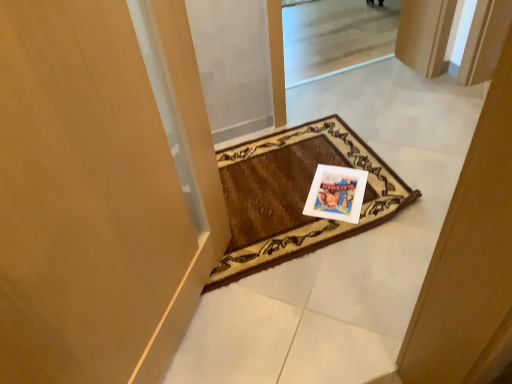
Question: Looking at their shapes, would you say white paper postcard at center is wider or thinner than brown woven mat at center?

Choices:
 (A) thin
 (B) wide

Answer: (A)

Question: Looking at the image, does white paper postcard at center seem bigger or smaller compared to brown woven mat at center?

Choices:
 (A) small
 (B) big

Answer: (A)

Question: Would you say white paper postcard at center is inside or outside brown woven mat at center?

Choices:
 (A) outside
 (B) inside

Answer: (B)

Question: Is brown woven mat at center wider or thinner than white paper postcard at center?

Choices:
 (A) wide
 (B) thin

Answer: (A)

Question: In terms of height, does brown woven mat at center look taller or shorter compared to white paper postcard at center?

Choices:
 (A) short
 (B) tall

Answer: (B)

Question: Visually, is brown woven mat at center positioned to the left or to the right of white paper postcard at center?

Choices:
 (A) right
 (B) left

Answer: (B)

Question: From a real-world perspective, relative to white paper postcard at center, is brown woven mat at center vertically above or below?

Choices:
 (A) below
 (B) above

Answer: (B)